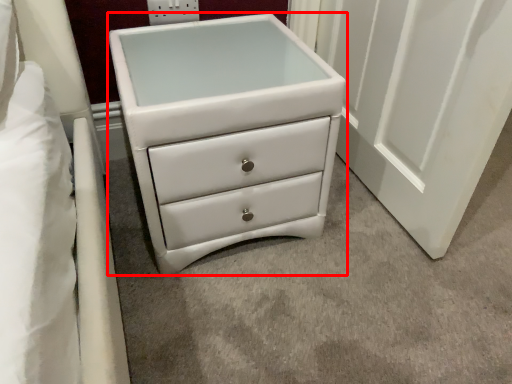
Question: In this image, where is chest of drawers (annotated by the red box) located relative to electric outlet?

Choices:
 (A) right
 (B) left

Answer: (A)